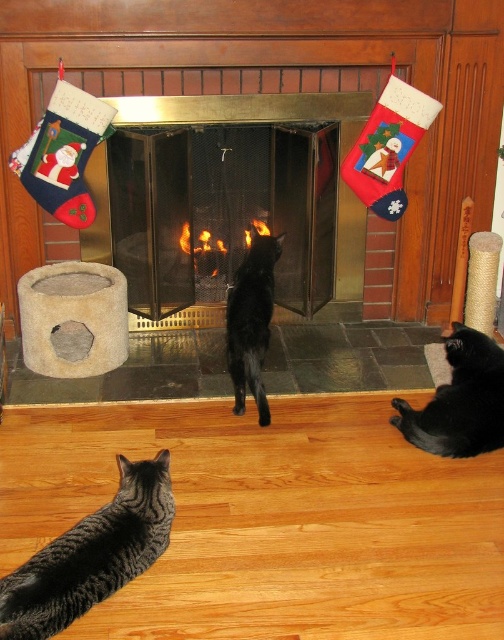
Measure the distance between tabby fur cat at lower left and metallic fireplace at center.

tabby fur cat at lower left is 4.93 feet away from metallic fireplace at center.

Which is behind, point (49, 620) or point (347, 252)?

Positioned behind is point (347, 252).

Identify the location of tabby fur cat at lower left. (92, 554).

Identify the location of tabby fur cat at lower left. (92, 554).

Is black fur cat at lower right above black glossy cat at center?

Incorrect, black fur cat at lower right is not positioned above black glossy cat at center.

Looking at this image, does black fur cat at lower right have a lesser height compared to black glossy cat at center?

Yes.

Is point (407, 412) in front of point (254, 264)?

Yes, point (407, 412) is closer to viewer.

At what (x,y) coordinates should I click in order to perform the action: click on black fur cat at lower right. Please return your answer as a coordinate pair (x, y). This screenshot has height=640, width=504. Looking at the image, I should click on (460, 401).

Where is `tabby fur cat at lower left`? This screenshot has height=640, width=504. tabby fur cat at lower left is located at coordinates (92, 554).

Does point (133, 566) come farther from viewer compared to point (238, 328)?

That is False.

The height and width of the screenshot is (640, 504). Find the location of `tabby fur cat at lower left`. tabby fur cat at lower left is located at coordinates (92, 554).